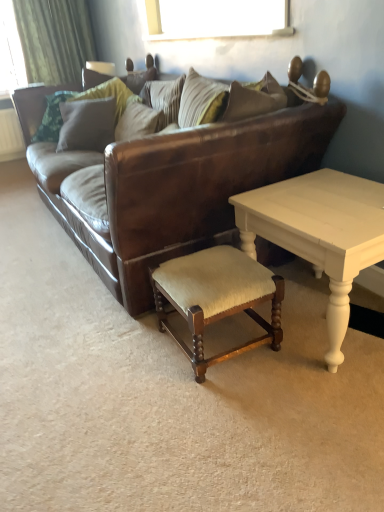
Identify the location of vacant space to the left of wooden upholstered stool at lower center. (125, 354).